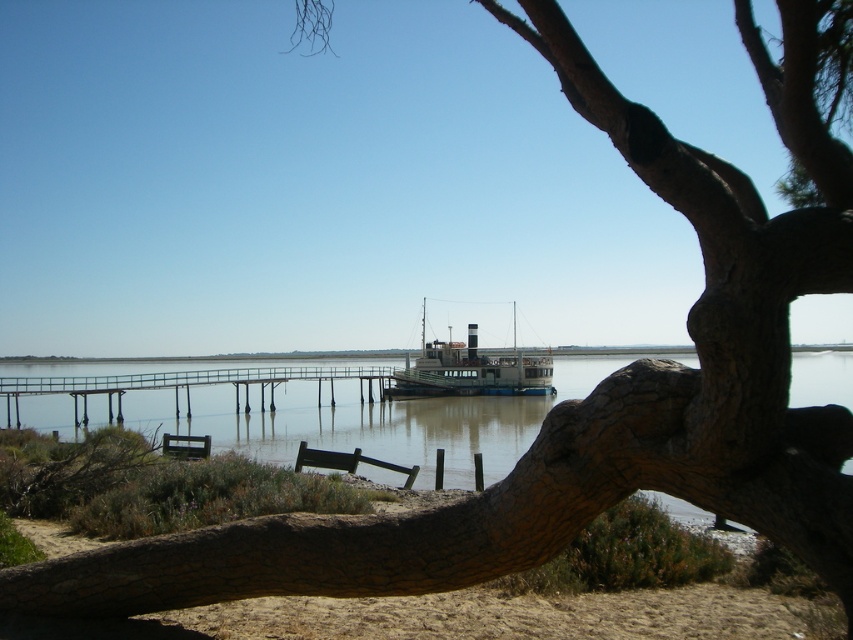
Question: Does greenish metallic boat at center appear on the right side of wooden park bench at lower center?

Choices:
 (A) yes
 (B) no

Answer: (A)

Question: Considering the relative positions of greenish metallic boat at center and wooden park bench at lower center in the image provided, where is greenish metallic boat at center located with respect to wooden park bench at lower center?

Choices:
 (A) left
 (B) right

Answer: (B)

Question: Which point is farther to the camera?

Choices:
 (A) wooden park bench at lower left
 (B) wooden park bench at lower center
 (C) wooden pier at center

Answer: (C)

Question: Does wooden pier at center have a greater width compared to wooden park bench at lower left?

Choices:
 (A) no
 (B) yes

Answer: (B)

Question: Which is nearer to the greenish metallic boat at center?

Choices:
 (A) wooden park bench at lower center
 (B) wooden pier at center

Answer: (B)

Question: Which point is farther to the camera?

Choices:
 (A) (368, 461)
 (B) (68, 419)

Answer: (B)